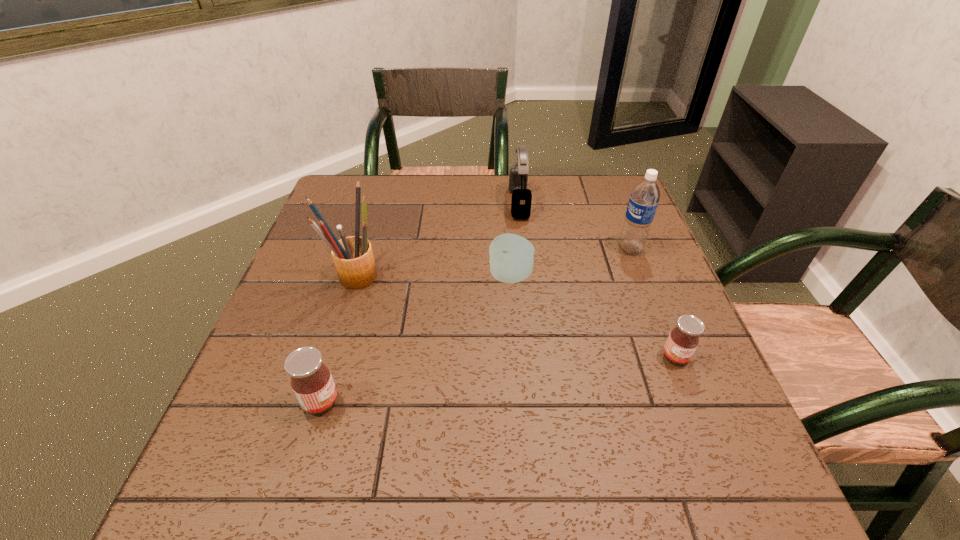
Identify which object is the fifth closest to the farthest object. Please provide its 2D coordinates. Your answer should be formatted as a tuple, i.e. [(x, y)], where the tuple contains the x and y coordinates of a point satisfying the conditions above.

[(311, 380)]

Point out which object is positioned as the second nearest to the water bottle. Please provide its 2D coordinates. Your answer should be formatted as a tuple, i.e. [(x, y)], where the tuple contains the x and y coordinates of a point satisfying the conditions above.

[(521, 200)]

Find the location of a particular element. free location that satisfies the following two spatial constraints: 1. on the headband of the headset; 2. on the back side of the water bottle is located at coordinates (524, 249).

Locate an element on the screen. This screenshot has height=540, width=960. free location that satisfies the following two spatial constraints: 1. on the back side of the water bottle; 2. on the left side of the apple is located at coordinates (509, 249).

At what (x,y) coordinates should I click in order to perform the action: click on blank space that satisfies the following two spatial constraints: 1. on the back side of the water bottle; 2. on the headband of the farthest object. Please return your answer as a coordinate pair (x, y). Looking at the image, I should click on (612, 203).